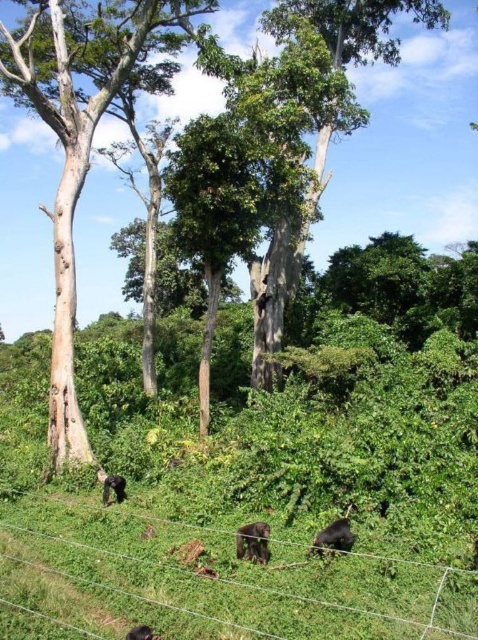
Question: In this image, where is wire mesh at lower center located relative to black fur monkey at lower center?

Choices:
 (A) left
 (B) right

Answer: (A)

Question: Is smooth light brown tree trunk at left above dark brown fur chimpanzee at lower center?

Choices:
 (A) no
 (B) yes

Answer: (B)

Question: Which of these objects is positioned farthest from the dark brown fur chimpanzee at lower center?

Choices:
 (A) dark brown fur at lower center
 (B) smooth light brown tree trunk at left
 (C) dark brown fur gorilla at lower center

Answer: (B)

Question: Which object is farther from the camera taking this photo?

Choices:
 (A) dark brown fur gorilla at lower center
 (B) wire mesh at lower center
 (C) smooth light brown tree trunk at left

Answer: (C)

Question: Can you confirm if wire mesh at lower center is positioned to the right of dark brown fur chimpanzee at lower center?

Choices:
 (A) no
 (B) yes

Answer: (B)

Question: Which object is the closest to the wire mesh at lower center?

Choices:
 (A) smooth light brown tree trunk at left
 (B) dark brown fur at lower center
 (C) dark brown fur chimpanzee at lower center
 (D) dark brown fur gorilla at lower center

Answer: (D)